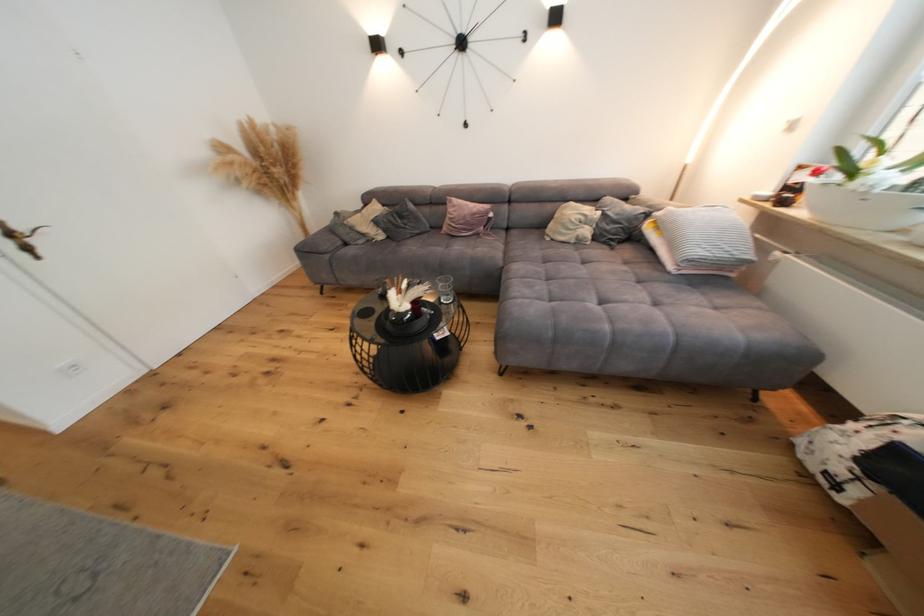
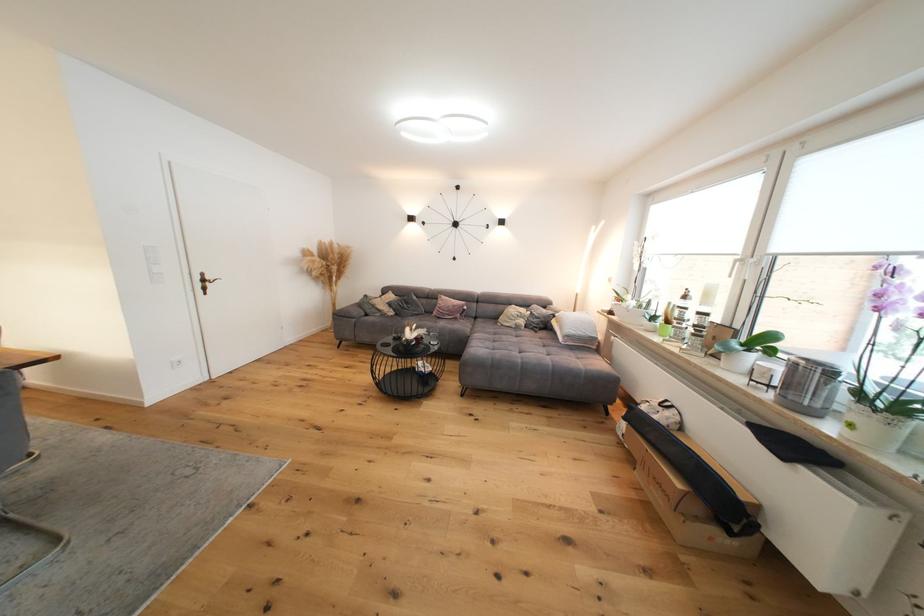
Find the pixel in the second image that matches [586,244] in the first image.

(524, 330)